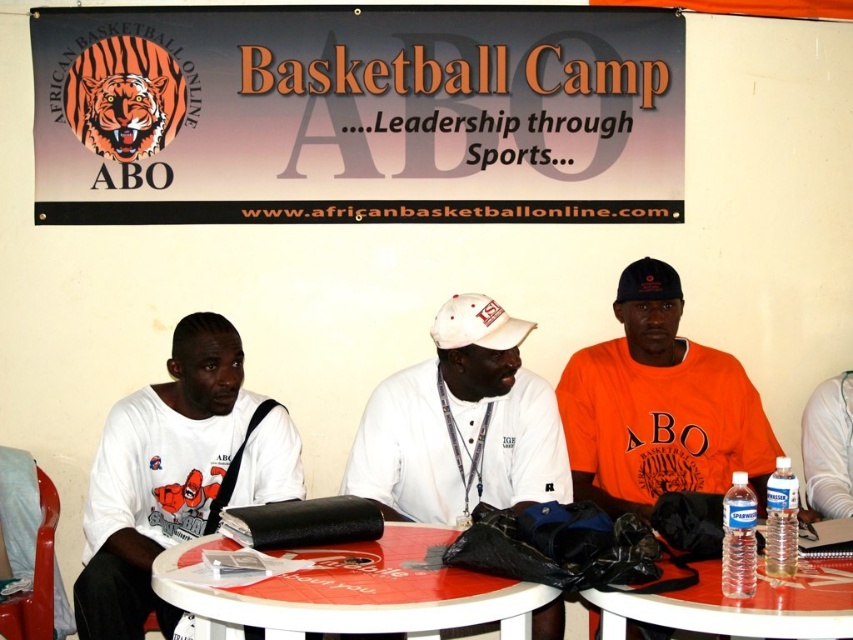
Question: Is orange matte t-shirt at center positioned in front of smooth plastic table at center?

Choices:
 (A) yes
 (B) no

Answer: (B)

Question: Considering the real-world distances, which object is farthest from the black fabric baseball cap at center?

Choices:
 (A) white matte cap at center
 (B) orange tiger banner at upper center
 (C) clear plastic water bottles at lower right

Answer: (C)

Question: Among these points, which one is nearest to the camera?

Choices:
 (A) (479, 362)
 (B) (740, 621)

Answer: (B)

Question: Where is orange matte t-shirt at center located in relation to black fabric baseball cap at center in the image?

Choices:
 (A) left
 (B) right

Answer: (B)

Question: Among these objects, which one is nearest to the camera?

Choices:
 (A) smooth plastic table at center
 (B) clear plastic water bottles at lower right
 (C) white fabric baseball cap at center
 (D) orange tiger banner at upper center

Answer: (B)

Question: Is the position of white matte cap at center more distant than that of black fabric baseball cap at center?

Choices:
 (A) yes
 (B) no

Answer: (B)